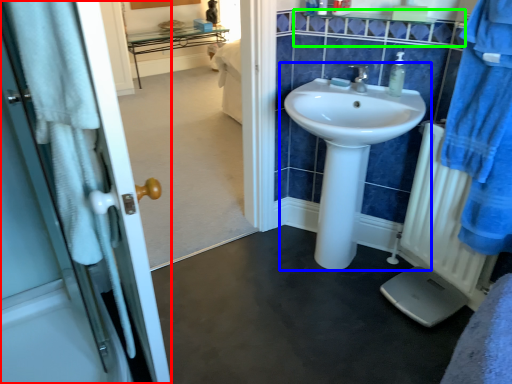
Question: Which object is the closest to the door (highlighted by a red box)? Choose among these: sink (highlighted by a blue box) or balustrade (highlighted by a green box).

Choices:
 (A) sink
 (B) balustrade

Answer: (A)